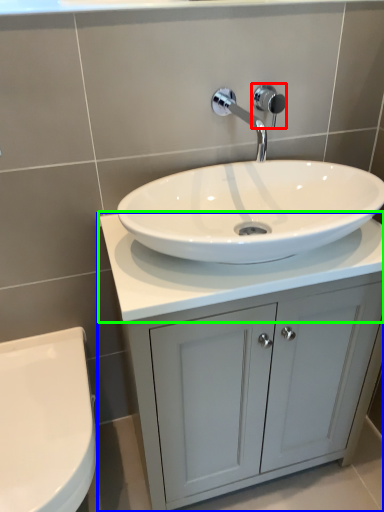
Question: Which is nearer to the shower (highlighted by a red box)? bathroom cabinet (highlighted by a blue box) or counter top (highlighted by a green box).

Choices:
 (A) bathroom cabinet
 (B) counter top

Answer: (B)